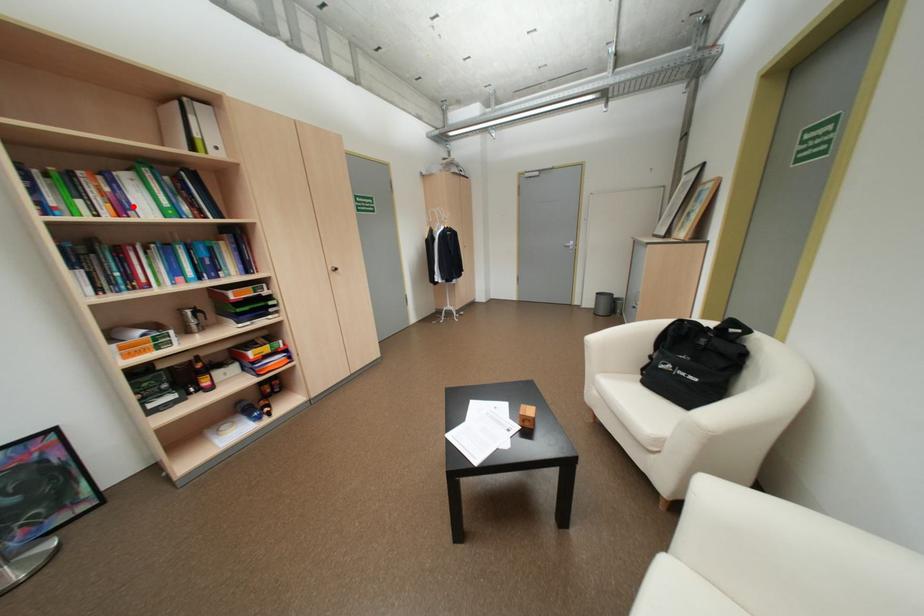
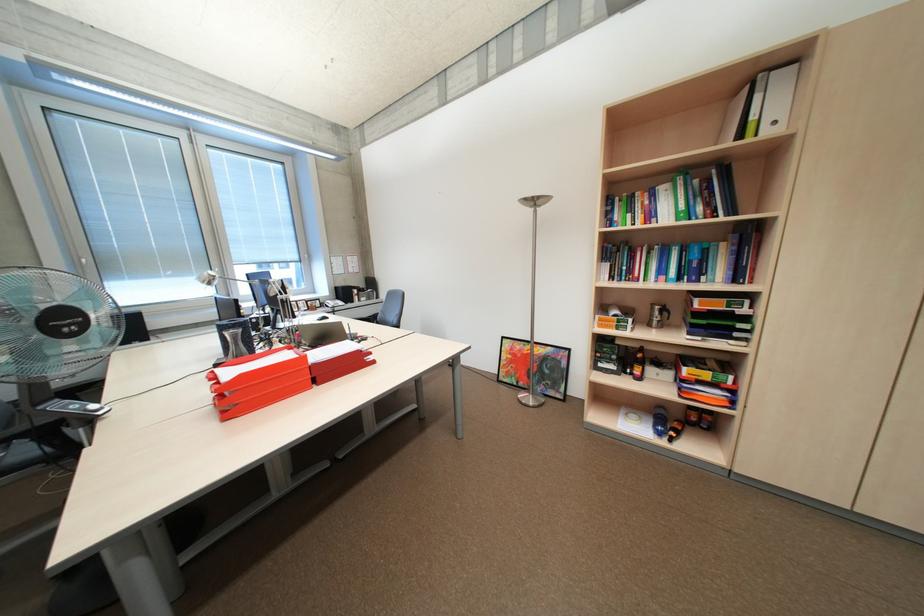
Locate, in the second image, the point that corresponds to the highlighted location in the first image.

(661, 215)